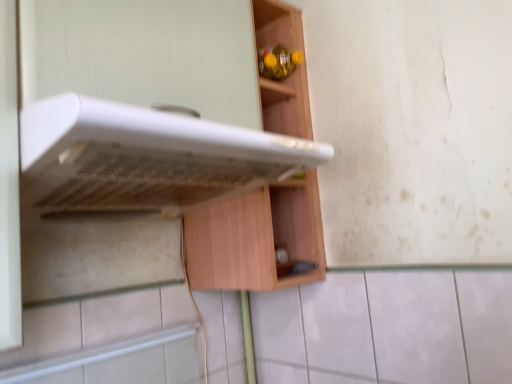
This screenshot has width=512, height=384. What do you see at coordinates (145, 159) in the screenshot?
I see `white plastic oven at upper center` at bounding box center [145, 159].

Where is `white plastic oven at upper center`? white plastic oven at upper center is located at coordinates (145, 159).

This screenshot has width=512, height=384. Identify the location of wooden cabinet at center. (256, 238).

This screenshot has width=512, height=384. What do you see at coordinates (256, 238) in the screenshot? I see `wooden cabinet at center` at bounding box center [256, 238].

Where is `white plastic oven at upper center`? white plastic oven at upper center is located at coordinates (145, 159).

Can you confirm if white plastic oven at upper center is positioned to the left of wooden cabinet at center?

Indeed, white plastic oven at upper center is positioned on the left side of wooden cabinet at center.

Which object is further away from the camera, white plastic oven at upper center or wooden cabinet at center?

wooden cabinet at center is behind.

Is point (213, 200) positioned after point (279, 183)?

Yes.

From the image's perspective, between white plastic oven at upper center and wooden cabinet at center, which one is located above?

From the image's view, wooden cabinet at center is above.

From a real-world perspective, does white plastic oven at upper center sit lower than wooden cabinet at center?

Yes.

Is white plastic oven at upper center thinner than wooden cabinet at center?

No.

Is white plastic oven at upper center shorter than wooden cabinet at center?

Yes.

Which of these two, white plastic oven at upper center or wooden cabinet at center, is smaller?

white plastic oven at upper center.

Is white plastic oven at upper center inside or outside of wooden cabinet at center?

white plastic oven at upper center is not enclosed by wooden cabinet at center.

Is white plastic oven at upper center next to wooden cabinet at center?

No, white plastic oven at upper center is not touching wooden cabinet at center.

Is white plastic oven at upper center turned away from wooden cabinet at center?

That's not correct — white plastic oven at upper center is not looking away from wooden cabinet at center.

How different are the orientations of white plastic oven at upper center and wooden cabinet at center in degrees?

The facing directions of white plastic oven at upper center and wooden cabinet at center are 0.681 degrees apart.

You are a GUI agent. You are given a task and a screenshot of the screen. Output one action in this format:
    pyautogui.click(x=<x>, y=<y>)
    Task: Click on the cabinetry above the white plastic oven at upper center (from a real-world perspective)
    The image size is (512, 384).
    Given the screenshot: What is the action you would take?
    pyautogui.click(x=256, y=238)

Can you confirm if wooden cabinet at center is positioned to the right of white plastic oven at upper center?

Yes, wooden cabinet at center is to the right of white plastic oven at upper center.

Is wooden cabinet at center positioned before white plastic oven at upper center?

No, wooden cabinet at center is further to the viewer.

Is point (217, 213) farther from viewer compared to point (80, 157)?

Yes, it is.

From the image's perspective, which object appears higher, wooden cabinet at center or white plastic oven at upper center?

A: wooden cabinet at center is shown above in the image.

From a real-world perspective, relative to white plastic oven at upper center, is wooden cabinet at center vertically above or below?

In terms of real-world spatial position, wooden cabinet at center is above white plastic oven at upper center.

Which of these two, wooden cabinet at center or white plastic oven at upper center, is wider?

white plastic oven at upper center is wider.

Considering the relative sizes of wooden cabinet at center and white plastic oven at upper center in the image provided, is wooden cabinet at center taller than white plastic oven at upper center?

Correct, wooden cabinet at center is much taller as white plastic oven at upper center.

Considering the sizes of objects wooden cabinet at center and white plastic oven at upper center in the image provided, who is smaller, wooden cabinet at center or white plastic oven at upper center?

white plastic oven at upper center is smaller.

Is white plastic oven at upper center inside wooden cabinet at center?

No, white plastic oven at upper center is not inside wooden cabinet at center.

Is wooden cabinet at center not near white plastic oven at upper center?

No, wooden cabinet at center is not far from white plastic oven at upper center.

Is wooden cabinet at center turned away from white plastic oven at upper center?

wooden cabinet at center does not have its back to white plastic oven at upper center.

How much distance is there between wooden cabinet at center and white plastic oven at upper center?

wooden cabinet at center is 9.91 inches from white plastic oven at upper center.

This screenshot has width=512, height=384. Identify the location of cabinetry above the white plastic oven at upper center (from a real-world perspective). (256, 238).

The width and height of the screenshot is (512, 384). Identify the location of cabinetry that is behind the white plastic oven at upper center. click(256, 238).

At what (x,y) coordinates should I click in order to perform the action: click on cabinetry that appears on the right of white plastic oven at upper center. Please return your answer as a coordinate pair (x, y). The image size is (512, 384). Looking at the image, I should click on (256, 238).